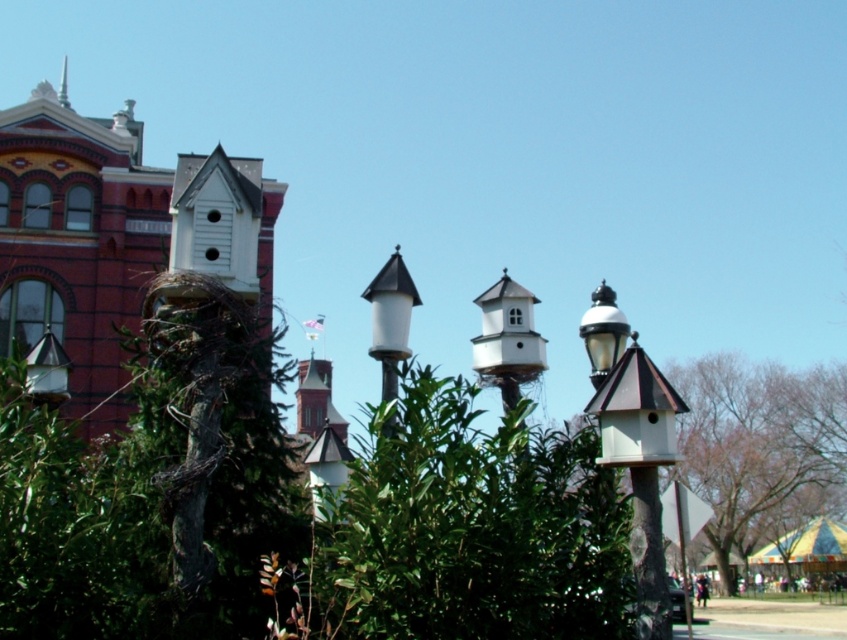
Question: Which point appears farthest from the camera in this image?

Choices:
 (A) (386, 451)
 (B) (59, 252)
 (C) (750, 461)

Answer: (C)

Question: Can you confirm if white wood birdhouse at left is positioned above green leafy tree at lower right?

Choices:
 (A) yes
 (B) no

Answer: (A)

Question: Is green leafy bush at center thinner than white glossy lamp post at center?

Choices:
 (A) yes
 (B) no

Answer: (B)

Question: Which object is positioned farthest from the green leafy bush at center?

Choices:
 (A) green leafy tree at lower right
 (B) white wood birdhouse at left

Answer: (A)

Question: Does white glossy lamp post at center have a larger size compared to green metallic spire at upper left?

Choices:
 (A) yes
 (B) no

Answer: (B)

Question: Which point is farther from the camera taking this photo?

Choices:
 (A) (407, 308)
 (B) (490, 436)
 (C) (701, 472)
 (D) (136, 218)

Answer: (C)